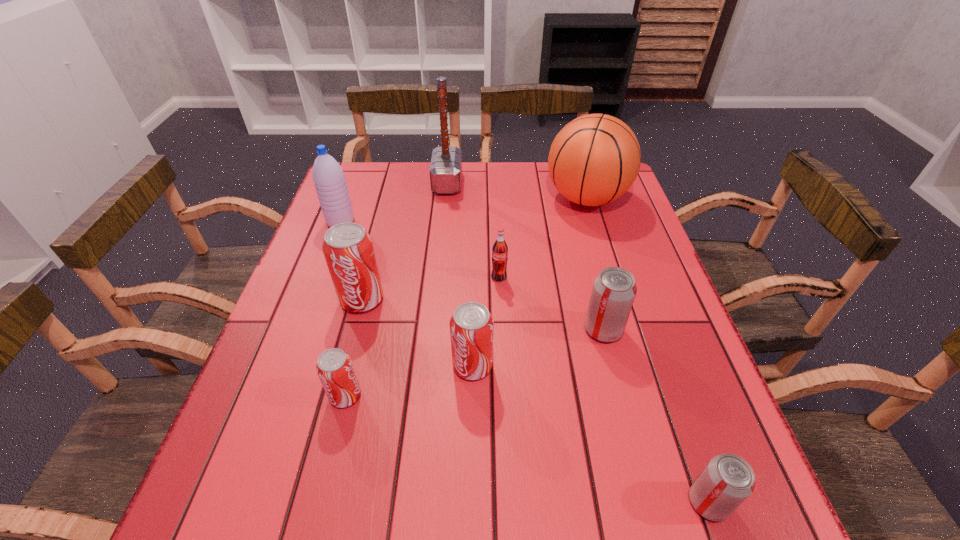
Find the location of `vacant region that satisfies the following two spatial constraints: 1. on the label of the bigger gray soda can; 2. on the left side of the third soda can from right to left`. vacant region that satisfies the following two spatial constraints: 1. on the label of the bigger gray soda can; 2. on the left side of the third soda can from right to left is located at coordinates (501, 330).

The height and width of the screenshot is (540, 960). I want to click on vacant space that satisfies the following two spatial constraints: 1. on the logo side of the nearer gray soda can; 2. on the left side of the smallest red soda can, so click(x=319, y=502).

Identify the location of vacant space that satisfies the following two spatial constraints: 1. on the label of the left gray soda can; 2. on the left side of the farthest soda can. (501, 330).

I want to click on free space in the image that satisfies the following two spatial constraints: 1. on the logo side of the bigger gray soda can; 2. on the left side of the farthest red soda can, so click(x=354, y=330).